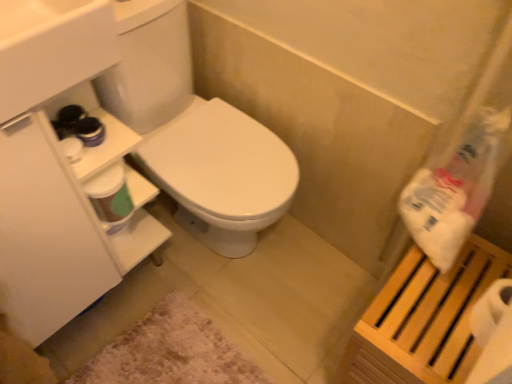
This screenshot has height=384, width=512. What are the coordinates of `free spot below white fluffy bath mat at lower center (from a real-world perspective)` in the screenshot? It's located at (172, 354).